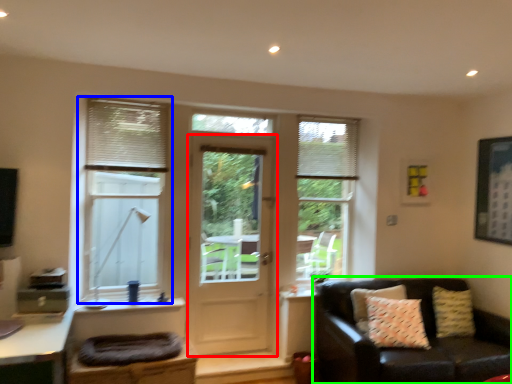
Question: Estimate the real-world distances between objects in this image. Which object is farther from door (highlighted by a red box), window (highlighted by a blue box) or studio couch (highlighted by a green box)?

Choices:
 (A) window
 (B) studio couch

Answer: (B)